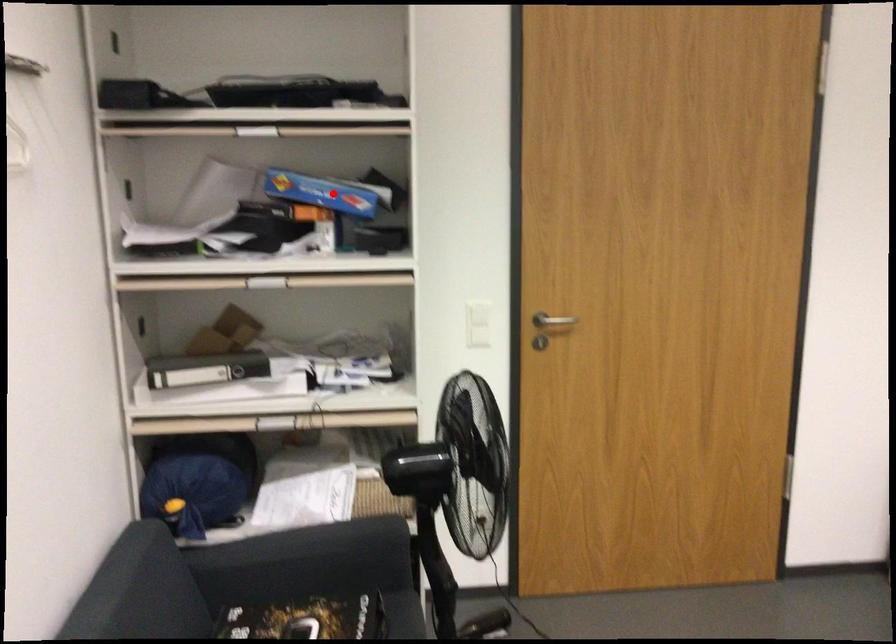
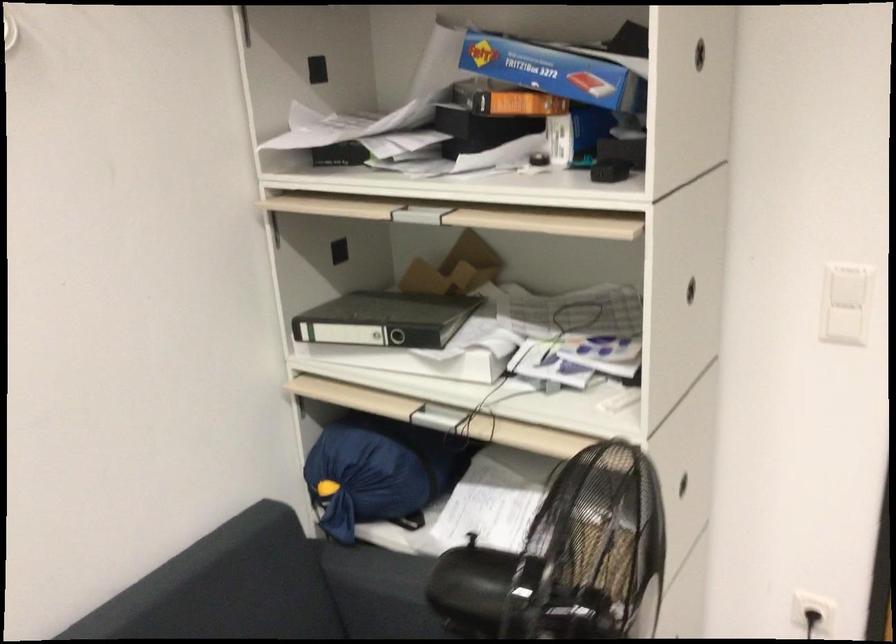
The point at the highlighted location is marked in the first image. Where is the corresponding point in the second image?

(553, 71)